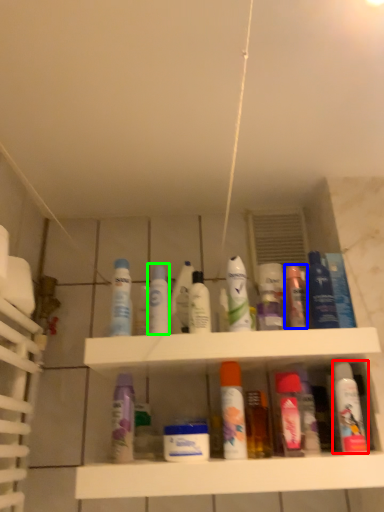
Question: Estimate the real-world distances between objects in this image. Which object is closer to mouthwash (highlighted by a red box), toiletry (highlighted by a blue box) or mouthwash (highlighted by a green box)?

Choices:
 (A) toiletry
 (B) mouthwash

Answer: (A)